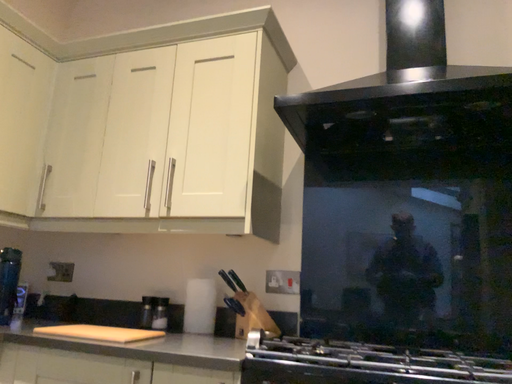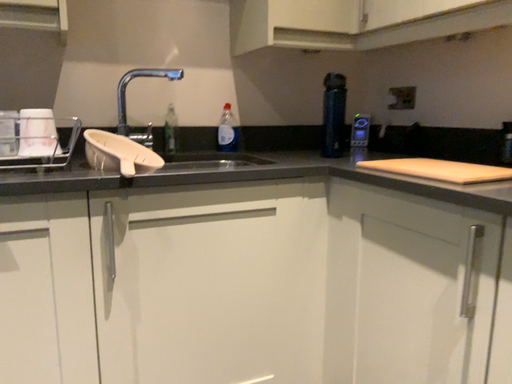
Question: Which way did the camera rotate in the video?

Choices:
 (A) rotated right
 (B) rotated left

Answer: (B)